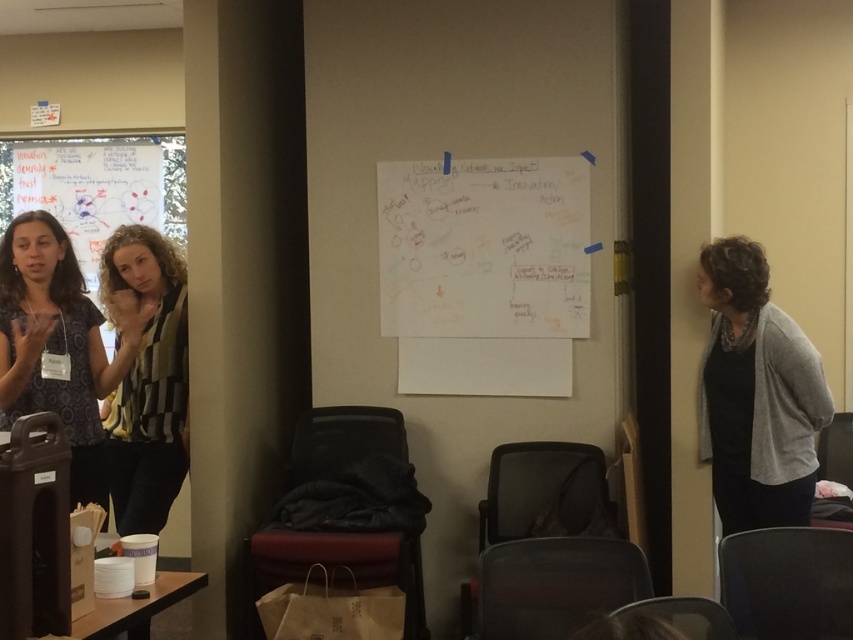
Can you confirm if white paper at center is positioned to the right of black leather chair at lower right?

In fact, white paper at center is to the left of black leather chair at lower right.

Is white paper at center shorter than black leather chair at lower right?

Incorrect, white paper at center's height does not fall short of black leather chair at lower right's.

Which is behind, point (399, 259) or point (784, 636)?

The point (399, 259) is more distant.

The width and height of the screenshot is (853, 640). In order to click on white paper at center in this screenshot , I will do point(485,273).

Who is positioned more to the left, black mesh chair at center or gray fabric chair at lower right?

From the viewer's perspective, black mesh chair at center appears more on the left side.

Does point (514, 477) lie behind point (672, 609)?

That is True.

What do you see at coordinates (541, 488) in the screenshot? This screenshot has width=853, height=640. I see `black mesh chair at center` at bounding box center [541, 488].

Locate an element on the screen. The width and height of the screenshot is (853, 640). black mesh chair at center is located at coordinates (541, 488).

Between black checkered shirt at center and gray fabric chair at lower right, which one is positioned higher?

black checkered shirt at center

In the scene shown: Between black checkered shirt at center and gray fabric chair at lower right, which one has more height?

black checkered shirt at center

Measure the distance between point (126, 388) and camera.

Point (126, 388) and camera are 11.51 feet apart.

The height and width of the screenshot is (640, 853). I want to click on black checkered shirt at center, so click(146, 378).